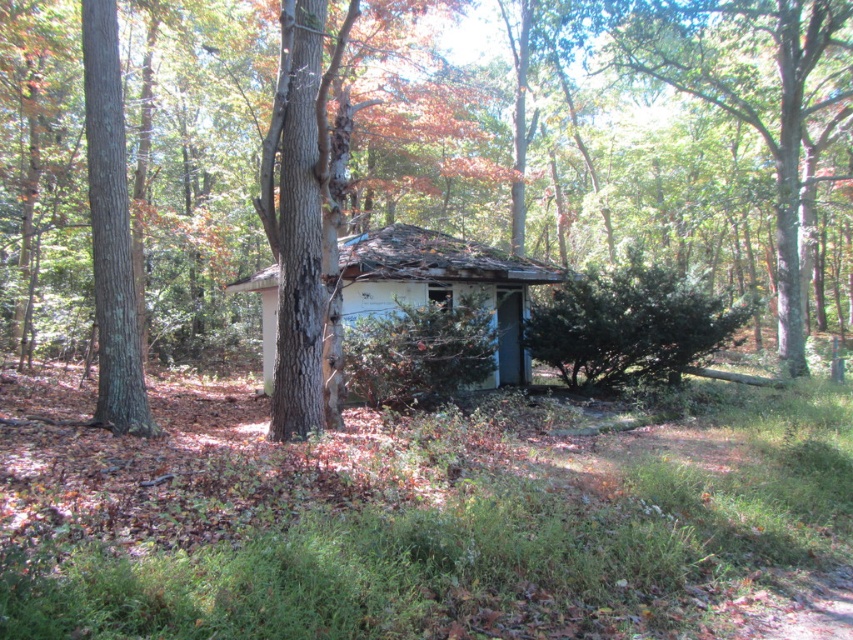
Question: Does white weathered hut at center have a smaller size compared to brown rough tree at left?

Choices:
 (A) no
 (B) yes

Answer: (A)

Question: Can you confirm if green leafy tree at upper right is positioned below white weathered hut at center?

Choices:
 (A) yes
 (B) no

Answer: (B)

Question: Which of these objects is positioned closest to the white weathered hut at center?

Choices:
 (A) brown rough tree at left
 (B) green leafy tree at upper right

Answer: (A)

Question: Among these points, which one is nearest to the camera?

Choices:
 (A) (0, 74)
 (B) (801, 125)
 (C) (495, 285)
 (D) (122, 164)

Answer: (D)

Question: Does white weathered hut at center come in front of brown rough tree at left?

Choices:
 (A) yes
 (B) no

Answer: (B)

Question: Which object is positioned farthest from the brown rough tree at center?

Choices:
 (A) brown rough tree at left
 (B) white weathered hut at center
 (C) green leafy tree at upper right

Answer: (A)